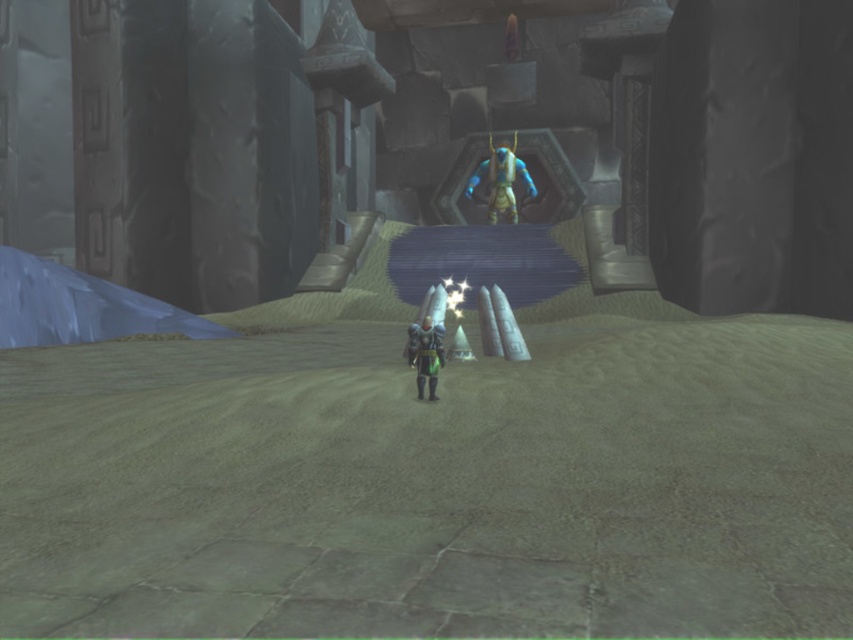
Question: Is blue metallic armor at center bigger than shiny metallic armor at center?

Choices:
 (A) no
 (B) yes

Answer: (B)

Question: Which point is farther to the camera?

Choices:
 (A) (502, 200)
 (B) (409, 353)

Answer: (A)

Question: Which point appears closest to the camera in this image?

Choices:
 (A) (505, 195)
 (B) (419, 392)

Answer: (B)

Question: Does blue metallic armor at center appear under shiny metallic armor at center?

Choices:
 (A) no
 (B) yes

Answer: (A)

Question: Can you confirm if blue metallic armor at center is positioned to the left of shiny metallic armor at center?

Choices:
 (A) yes
 (B) no

Answer: (B)